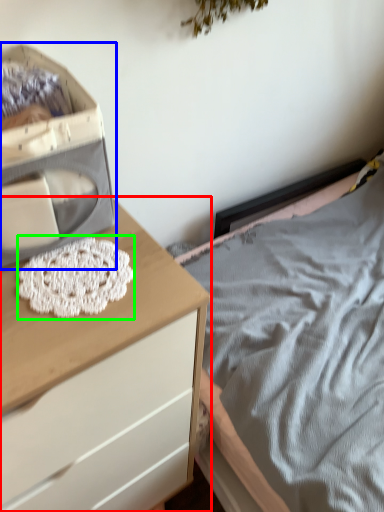
Question: Which is nearer to the chest of drawers (highlighted by a red box)? storage box (highlighted by a blue box) or lace (highlighted by a green box).

Choices:
 (A) storage box
 (B) lace

Answer: (B)